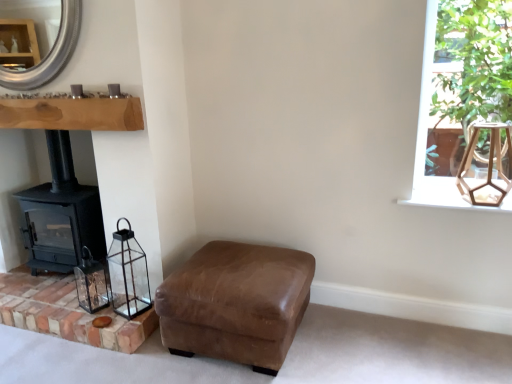
Question: Is green leafy plant at upper right oriented away from silver metallic mirror at upper left?

Choices:
 (A) yes
 (B) no

Answer: (B)

Question: Is green leafy plant at upper right smaller than silver metallic mirror at upper left?

Choices:
 (A) yes
 (B) no

Answer: (B)

Question: Can you confirm if green leafy plant at upper right is wider than silver metallic mirror at upper left?

Choices:
 (A) yes
 (B) no

Answer: (A)

Question: From the image's perspective, is green leafy plant at upper right on silver metallic mirror at upper left?

Choices:
 (A) yes
 (B) no

Answer: (B)

Question: From a real-world perspective, is green leafy plant at upper right over silver metallic mirror at upper left?

Choices:
 (A) yes
 (B) no

Answer: (B)

Question: In terms of height, does clear glass lantern at lower left, positioned as the second lamp in right-to-left order, look taller or shorter compared to brown leather ottoman at lower center?

Choices:
 (A) tall
 (B) short

Answer: (A)

Question: From the image's perspective, is clear glass lantern at lower left, acting as the first lamp starting from the left, located above or below brown leather ottoman at lower center?

Choices:
 (A) below
 (B) above

Answer: (B)

Question: Considering the positions of clear glass lantern at lower left, the 2th lamp from the top, and brown leather ottoman at lower center in the image, is clear glass lantern at lower left, the 2th lamp from the top, wider or thinner than brown leather ottoman at lower center?

Choices:
 (A) wide
 (B) thin

Answer: (B)

Question: From a real-world perspective, relative to brown leather ottoman at lower center, is clear glass lantern at lower left, the 1th lamp positioned from the bottom, vertically above or below?

Choices:
 (A) below
 (B) above

Answer: (B)

Question: In terms of width, does clear glass lantern at lower left look wider or thinner when compared to green leafy plant at upper right?

Choices:
 (A) thin
 (B) wide

Answer: (A)

Question: Is clear glass lantern at lower left to the left or to the right of green leafy plant at upper right in the image?

Choices:
 (A) left
 (B) right

Answer: (A)

Question: From their relative heights in the image, would you say clear glass lantern at lower left is taller or shorter than green leafy plant at upper right?

Choices:
 (A) tall
 (B) short

Answer: (B)

Question: Is point (97, 266) closer or farther from the camera than point (423, 155)?

Choices:
 (A) closer
 (B) farther

Answer: (B)

Question: In the image, is brickroughbrickwork at lower left on the left side or the right side of clear glass lantern at lower left?

Choices:
 (A) left
 (B) right

Answer: (A)

Question: Choose the correct answer: Is brickroughbrickwork at lower left inside clear glass lantern at lower left or outside it?

Choices:
 (A) inside
 (B) outside

Answer: (B)